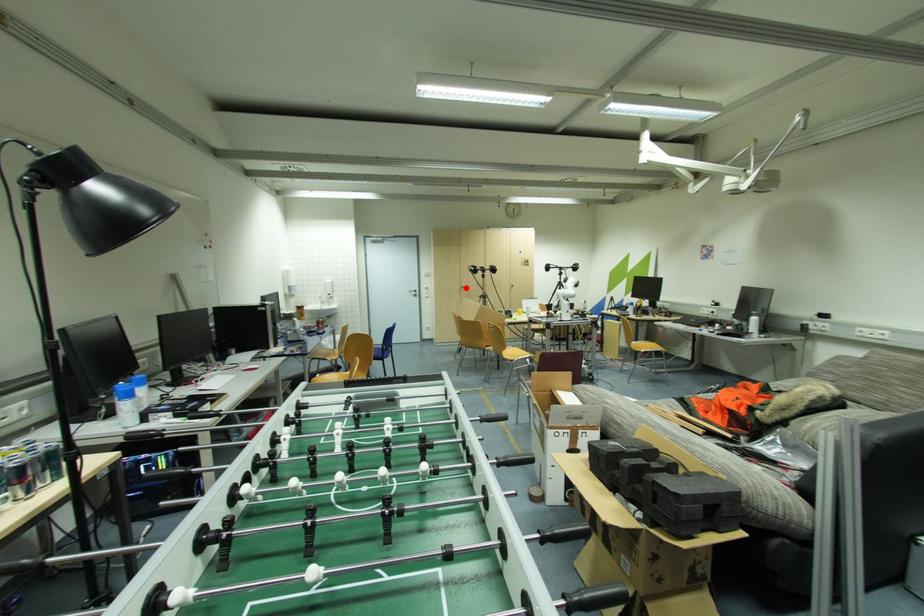
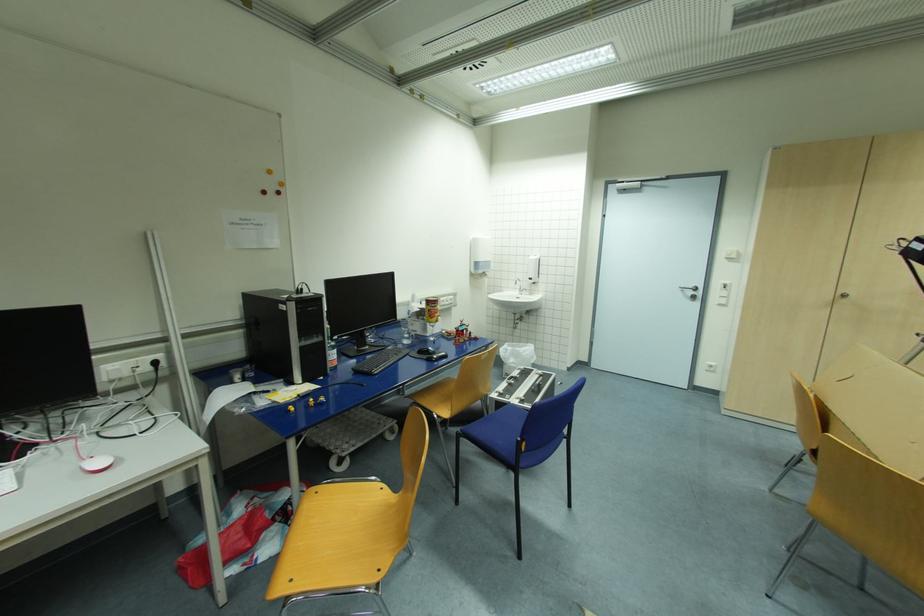
Find the pixel in the second image that matches the highlighted location in the first image.

(847, 296)